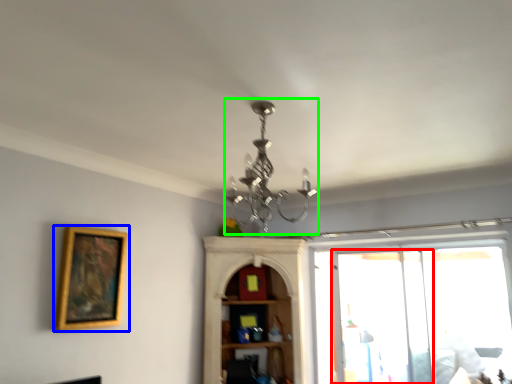
Question: Which object is the farthest from screen door (highlighted by a red box)? Choose among these: picture frame (highlighted by a blue box) or light fixture (highlighted by a green box).

Choices:
 (A) picture frame
 (B) light fixture

Answer: (A)